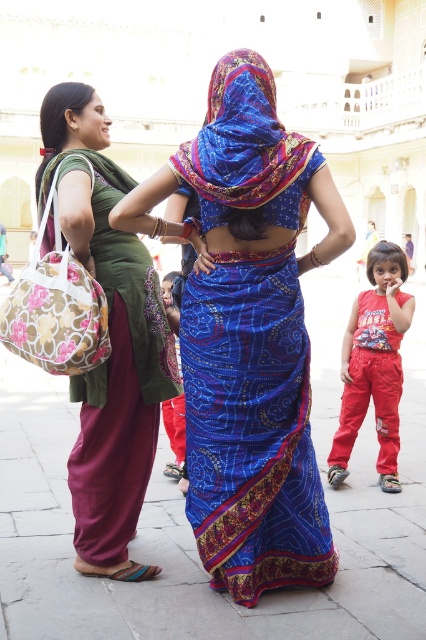
Question: Which of the following is the farthest from the observer?

Choices:
 (A) matte green sari at left
 (B) blue printed sari at center
 (C) red cotton pants at lower right
 (D) blue satin saree at center

Answer: (C)

Question: Considering the real-world distances, which object is closest to the matte green sari at left?

Choices:
 (A) blue printed sari at center
 (B) green silk sari at left
 (C) red cotton pants at lower right

Answer: (B)

Question: Does matte green sari at left appear over blue printed sari at center?

Choices:
 (A) yes
 (B) no

Answer: (B)

Question: Which point is closer to the camera?

Choices:
 (A) blue printed sari at center
 (B) green silk sari at left
 (C) red cotton pants at lower right
 (D) blue satin saree at center

Answer: (D)

Question: Does blue satin saree at center have a greater width compared to green silk sari at left?

Choices:
 (A) yes
 (B) no

Answer: (A)

Question: Is blue satin saree at center behind red cotton pants at lower right?

Choices:
 (A) yes
 (B) no

Answer: (B)